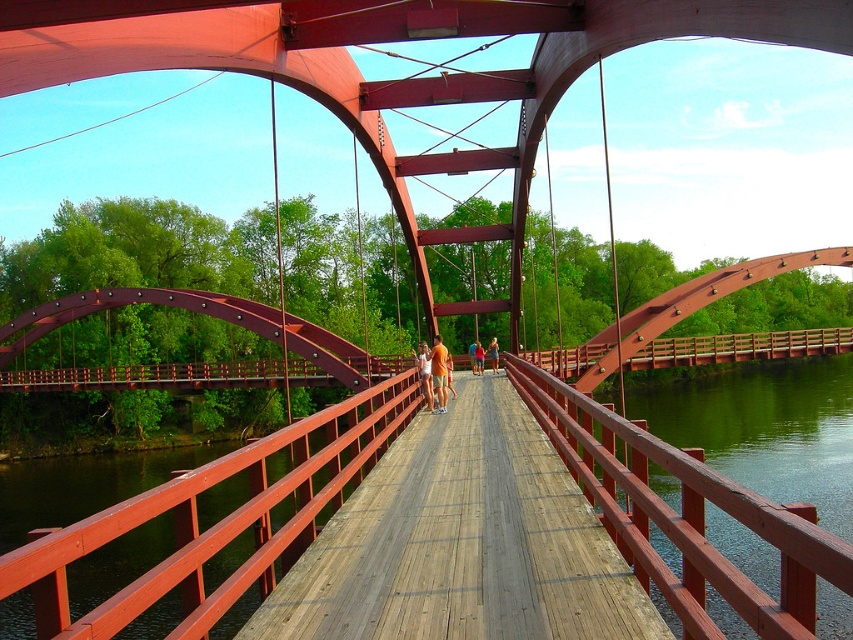
Question: Does green smooth water at right lie behind matte brown shorts at center?

Choices:
 (A) no
 (B) yes

Answer: (A)

Question: Based on their relative distances, which object is farther from the matte orange shorts at center?

Choices:
 (A) wooden bridge at center
 (B) orange cotton shirt at center
 (C) orange shirt at center
 (D) matte brown shorts at center

Answer: (A)

Question: Among these objects, which one is farthest from the camera?

Choices:
 (A) orange cotton shirt at center
 (B) wooden bridge at center
 (C) green smooth water at right

Answer: (A)

Question: Which point appears closest to the camera in this image?

Choices:
 (A) (648, 401)
 (B) (482, 353)
 (C) (428, 385)
 (D) (496, 360)

Answer: (C)

Question: Does wooden bridge at center appear on the right side of orange cotton shirt at center?

Choices:
 (A) yes
 (B) no

Answer: (A)

Question: Does wooden bridge at center have a greater width compared to orange shirt at center?

Choices:
 (A) yes
 (B) no

Answer: (A)